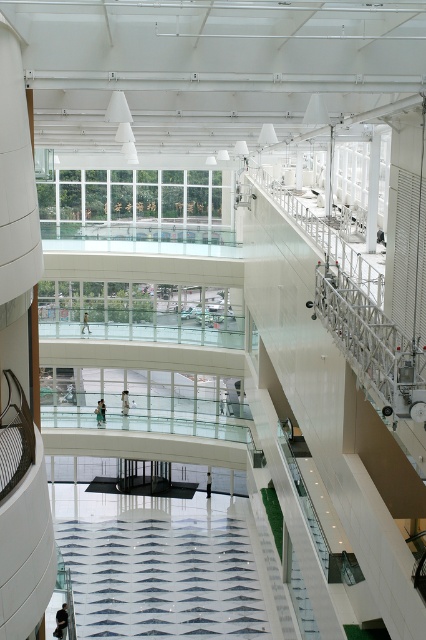
You are a customer looking to hang a coat on a hook located at the lower center of the image. You have a light brown leather jacket at lower center and a white textured fabric at center. Which item is taller and needs to be adjusted to ensure it doesn not block the hook?

The white textured fabric at center is taller than the light brown leather jacket at lower center, so you should adjust the white textured fabric at center to ensure it does not block the hook.

You are standing at the entrance of the modern building and want to locate the white textured fabric at center. Based on the coordinates provided, where should you look relative to your position?

The white textured fabric at center is located at coordinates point (163,577), which means it is positioned towards the upper right area of the scene from your perspective.

You are standing at the entrance of the mall and want to reach the light blue fabric person at center. There is a white glossy pillar at left blocking your path. Can you walk around it to reach the person without going through any doors?

The white glossy pillar at left and light blue fabric person at center are 27.56 meters apart, so yes, you can walk around the white glossy pillar at left to reach the light blue fabric person at center without needing to go through any doors since the distance allows for maneuvering around the pillar.